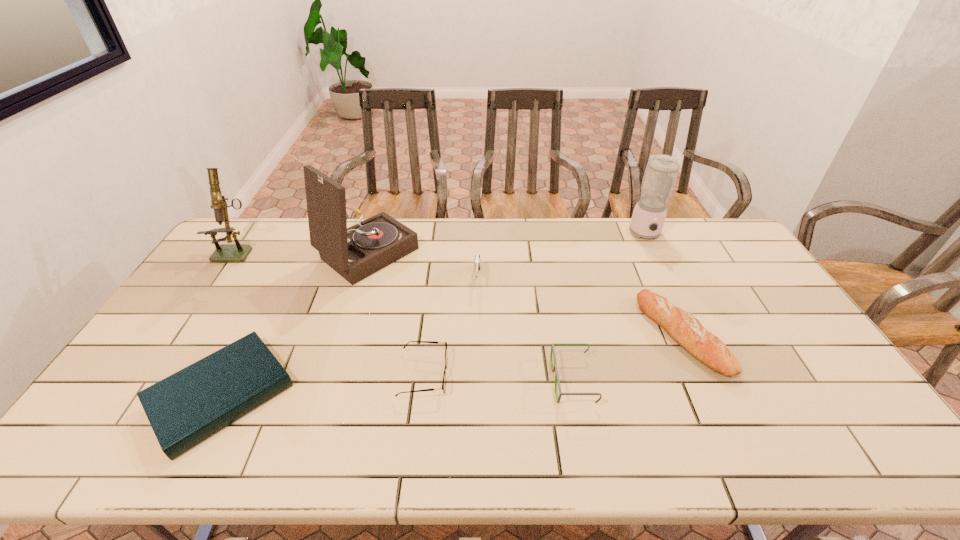
This screenshot has height=540, width=960. I want to click on free region located on the base of the food processor near the control knob, so click(x=664, y=273).

Where is `vacant space situated 0.210m at the eyepiece of the microscope`? vacant space situated 0.210m at the eyepiece of the microscope is located at coordinates (202, 306).

At what (x,y) coordinates should I click in order to perform the action: click on blank space located 0.330m at the muzzle of the fourth object from right to left. Please return your answer as a coordinate pair (x, y). Looking at the image, I should click on (477, 381).

Locate an element on the screen. The height and width of the screenshot is (540, 960). free space located on the left of the fifth tallest object is located at coordinates (581, 335).

Where is `free space located on the lens of the third object from right to left`? The width and height of the screenshot is (960, 540). free space located on the lens of the third object from right to left is located at coordinates (504, 380).

This screenshot has height=540, width=960. Identify the location of free region located 0.080m on the lens of the third object from right to left. (523, 380).

At what (x,y) coordinates should I click in order to perform the action: click on free space located on the lens of the third object from right to left. Please return your answer as a coordinate pair (x, y). The height and width of the screenshot is (540, 960). Looking at the image, I should click on (523, 380).

At what (x,y) coordinates should I click in order to perform the action: click on vacant space situated on the front-facing side of the left spectacles. Please return your answer as a coordinate pair (x, y). The width and height of the screenshot is (960, 540). Looking at the image, I should click on (570, 375).

Locate an element on the screen. free space located 0.330m on the back of the book is located at coordinates (286, 268).

Where is `phonograph record that is at the far edge`? The image size is (960, 540). phonograph record that is at the far edge is located at coordinates (355, 253).